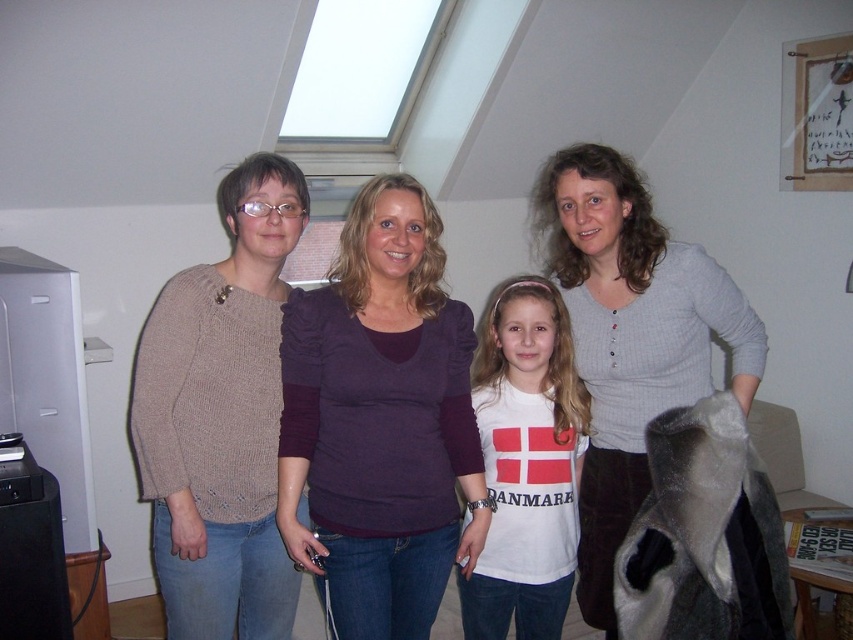
Question: Which of the following is the farthest from the observer?

Choices:
 (A) (734, 289)
 (B) (688, 368)
 (C) (236, 352)
 (D) (410, 440)

Answer: (A)

Question: Is knitted beige sweater at left below matte purple sweater at center?

Choices:
 (A) yes
 (B) no

Answer: (A)

Question: Considering the relative positions of knitted beige sweater at left and gray textured sweater at center in the image provided, where is knitted beige sweater at left located with respect to gray textured sweater at center?

Choices:
 (A) above
 (B) below

Answer: (B)

Question: Which object appears farthest from the camera in this image?

Choices:
 (A) purple soft fabric shirt at center
 (B) knitted beige sweater at left
 (C) gray textured sweater at center
 (D) matte purple sweater at center

Answer: (D)

Question: Is matte purple sweater at center above white cotton shirt at center?

Choices:
 (A) no
 (B) yes

Answer: (B)

Question: Estimate the real-world distances between objects in this image. Which object is farther from the white cotton shirt at center?

Choices:
 (A) matte purple sweater at center
 (B) purple soft fabric shirt at center
 (C) knitted beige sweater at left

Answer: (C)